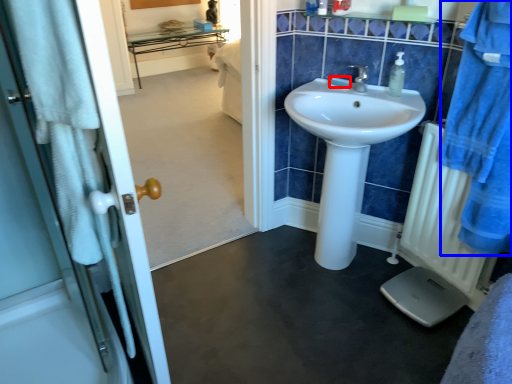
Question: Which point is closer to the camera, soap (highlighted by a red box) or bathrobe (highlighted by a blue box)?

Choices:
 (A) soap
 (B) bathrobe

Answer: (B)